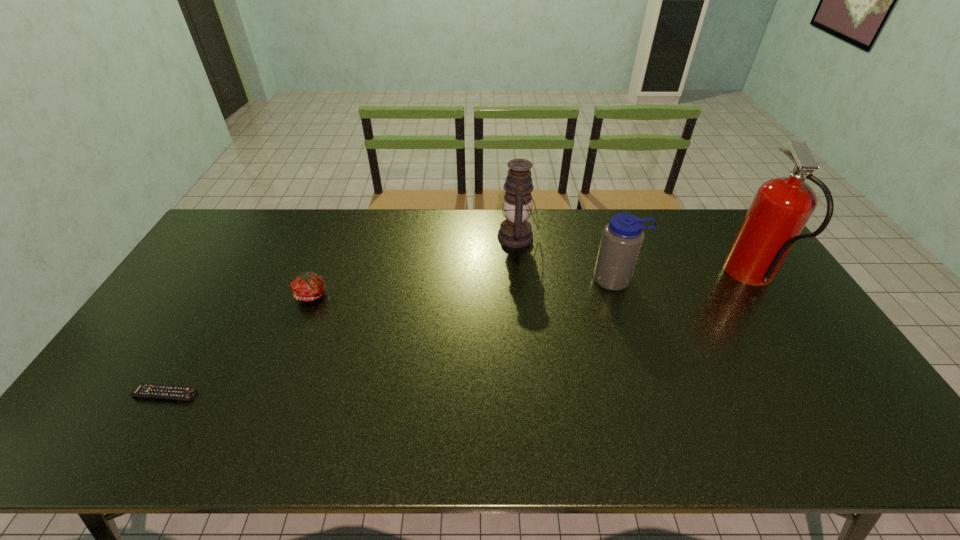
Identify the location of vacant space located with the handle and nozzle on the rightmost object. Image resolution: width=960 pixels, height=540 pixels. (676, 277).

Find the location of a particular element. vacant space situated 0.390m with the handle and nozzle on the rightmost object is located at coordinates (607, 277).

At what (x,y) coordinates should I click in order to perform the action: click on vacant space located 0.300m with the handle and nozzle on the rightmost object. Please return your answer as a coordinate pair (x, y). Looking at the image, I should click on (636, 277).

Identify the location of blank space located on the left of the third object from right to left. [x=410, y=237].

You are a GUI agent. You are given a task and a screenshot of the screen. Output one action in this format:
    pyautogui.click(x=<x>, y=<y>)
    Task: Click on the free space located with a carrying loop on the side of the second object from right to left
    The height and width of the screenshot is (540, 960).
    Given the screenshot: What is the action you would take?
    pyautogui.click(x=646, y=372)

You are a GUI agent. You are given a task and a screenshot of the screen. Output one action in this format:
    pyautogui.click(x=<x>, y=<y>)
    Task: Click on the free location located 0.190m on the right of the second object from left to right
    The width and height of the screenshot is (960, 540).
    Given the screenshot: What is the action you would take?
    pyautogui.click(x=393, y=295)

This screenshot has width=960, height=540. I want to click on free location located 0.280m on the right of the nearest object, so click(309, 394).

Locate an element on the screen. This screenshot has height=540, width=960. fire extinguisher at the far edge is located at coordinates (781, 208).

Identify the location of oil lamp that is at the far edge. The width and height of the screenshot is (960, 540). (515, 231).

Find the location of a particular element. object at the left edge is located at coordinates coord(146,390).